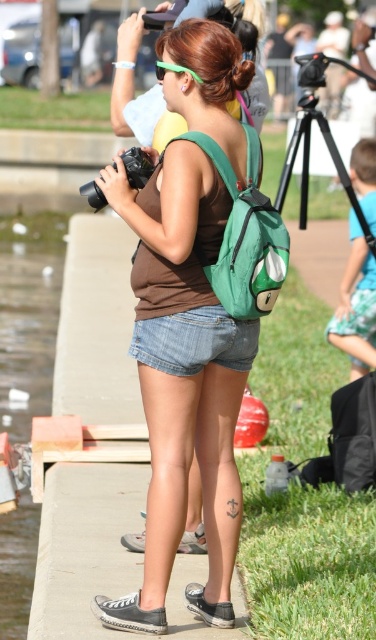
You are a photographer at the event and want to capture both the matte green backpack at center and the green plastic goggles at upper center in a single frame. Which object should you focus on first to ensure both are in the shot?

The matte green backpack at center is below green plastic goggles at upper center, so you should focus on the green plastic goggles at upper center first to ensure both are in the frame.

You are a photographer trying to capture the woman in the scene. The denim shorts at center and the gray canvas sneaker at lower center are both visible in your frame. Which object is closer to you, the photographer?

The denim shorts at center is closer to the viewer than the gray canvas sneaker at lower center, so the denim shorts at center is closer to you.